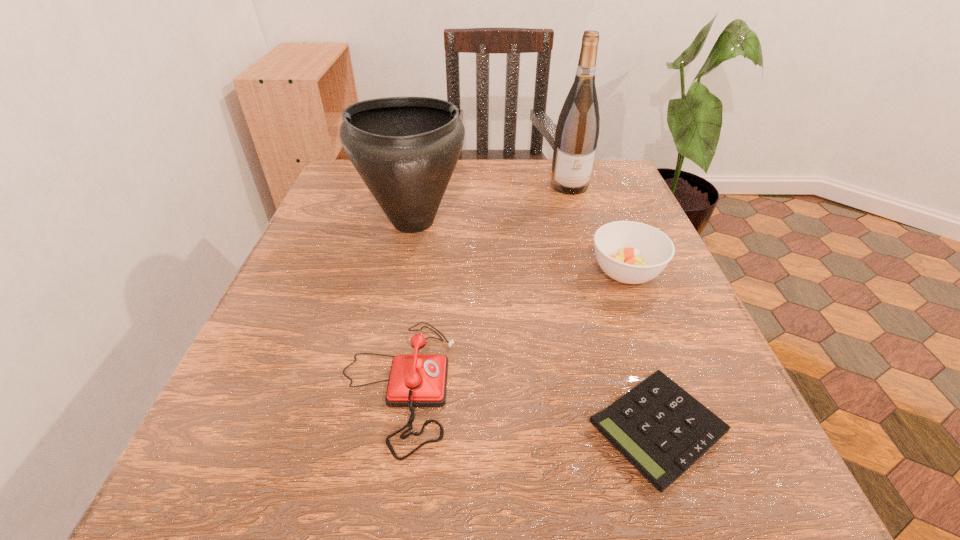
I want to click on the second closest object to the shortest object, so click(x=415, y=380).

The image size is (960, 540). I want to click on vacant space that satisfies the following two spatial constraints: 1. on the back side of the shortest object; 2. on the left side of the soup bowl, so click(x=606, y=272).

At what (x,y) coordinates should I click in order to perform the action: click on free space in the image that satisfies the following two spatial constraints: 1. on the label of the wine bottle; 2. on the left side of the soup bowl. Please return your answer as a coordinate pair (x, y). Looking at the image, I should click on (596, 272).

You are a GUI agent. You are given a task and a screenshot of the screen. Output one action in this format:
    pyautogui.click(x=<x>, y=<y>)
    Task: Click on the free space that satisfies the following two spatial constraints: 1. on the label of the tallest object; 2. on the left side of the soup bowl
    The height and width of the screenshot is (540, 960).
    Given the screenshot: What is the action you would take?
    pyautogui.click(x=596, y=272)

Locate an element on the screen. The image size is (960, 540). blank space that satisfies the following two spatial constraints: 1. on the label of the tallest object; 2. on the left side of the calculator is located at coordinates (644, 428).

The image size is (960, 540). What are the coordinates of `blank space that satisfies the following two spatial constraints: 1. on the label of the wine bottle; 2. on the dial of the telephone` in the screenshot? It's located at (631, 385).